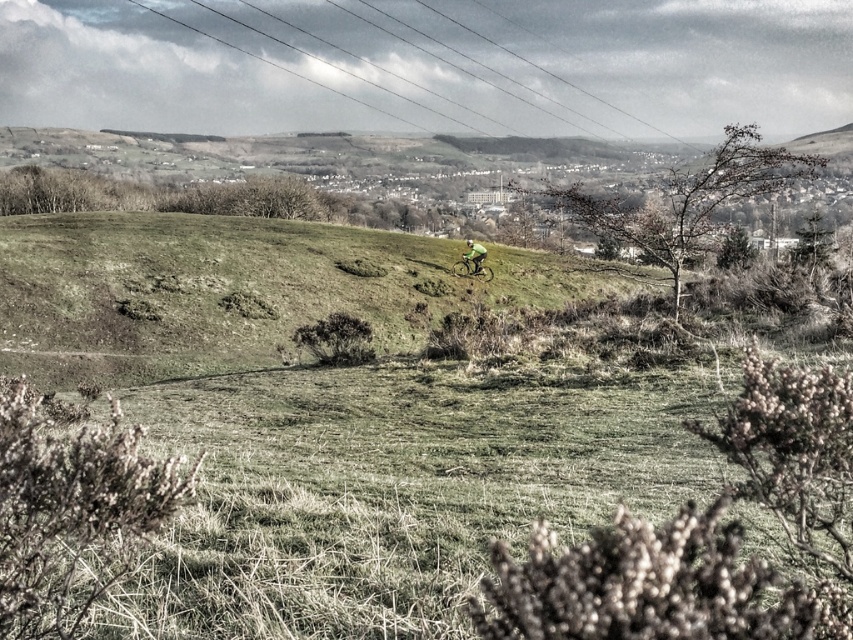
Question: Is green fabric cyclist at center above metallic wires at upper center?

Choices:
 (A) no
 (B) yes

Answer: (A)

Question: Which point is closer to the camera taking this photo?

Choices:
 (A) (469, 272)
 (B) (119, 360)
 (C) (247, 51)

Answer: (B)

Question: Considering the relative positions of metallic wires at upper center and green fabric bicycle at center in the image provided, where is metallic wires at upper center located with respect to green fabric bicycle at center?

Choices:
 (A) below
 (B) above

Answer: (B)

Question: Can you confirm if green matte mountain bike at center is positioned to the left of green fabric bicycle at center?

Choices:
 (A) yes
 (B) no

Answer: (B)

Question: Which of the following is the farthest from the observer?

Choices:
 (A) (676, 140)
 (B) (467, 259)

Answer: (A)

Question: Which of these objects is positioned closest to the green fabric bicycle at center?

Choices:
 (A) green matte mountain bike at center
 (B) green fabric cyclist at center
 (C) metallic wires at upper center

Answer: (A)